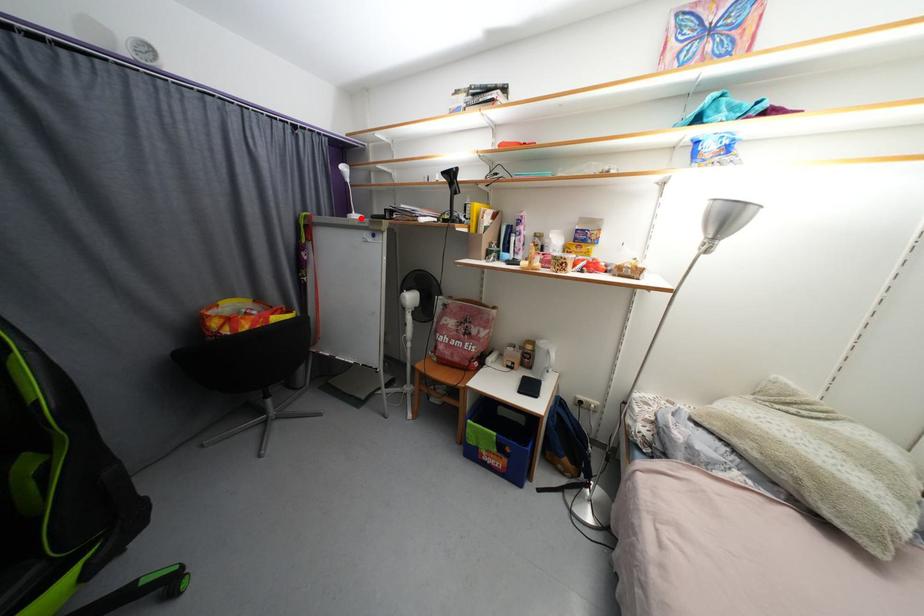
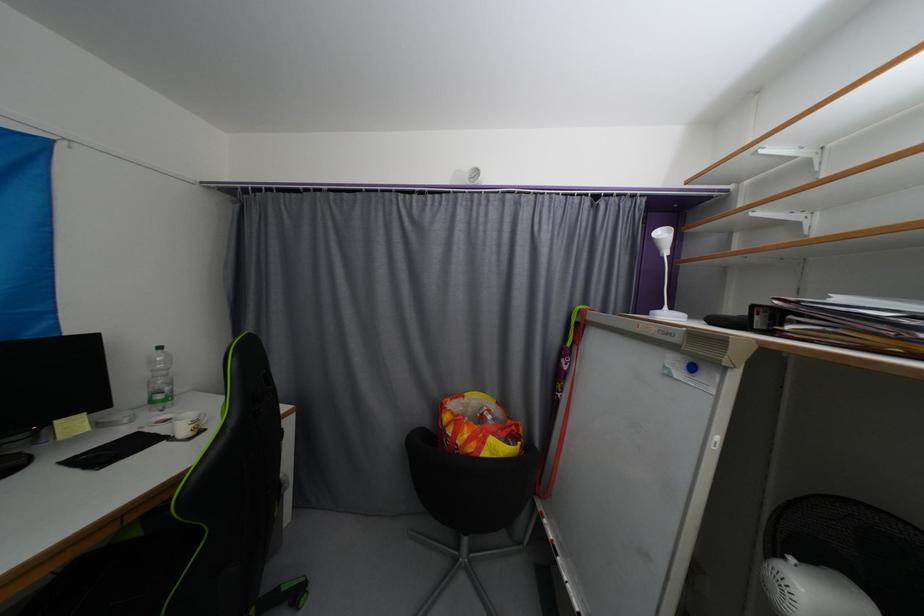
Question: I am providing you with two images of the same scene from different viewpoints. Given a red point in image1, look at the same physical point in image2. Is it:

Choices:
 (A) Closer to the viewpoint
 (B) Farther from the viewpoint

Answer: (B)